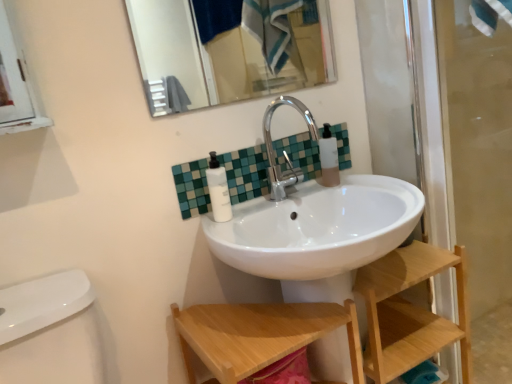
Identify the location of free space to the left of translucent plastic bottle at upper right, which is counted as the 1th toiletry, starting from the back. (298, 196).